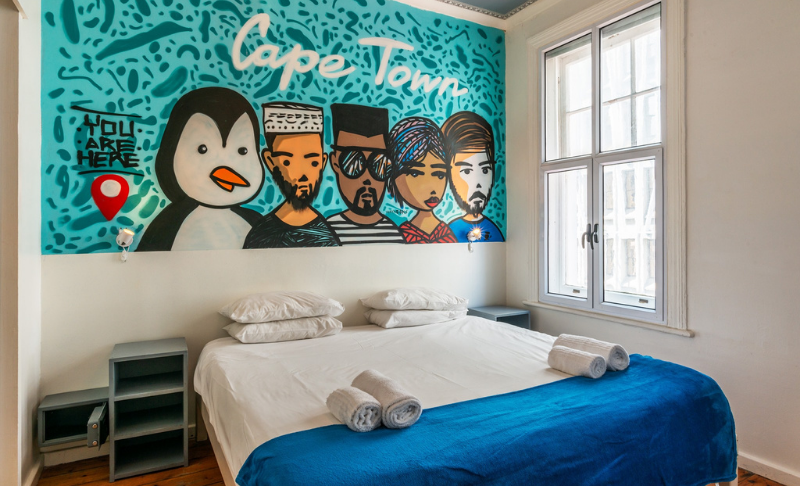
Identify the location of towel. (364, 415).